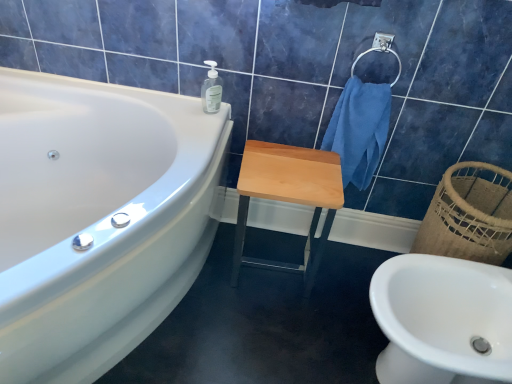
I want to click on free space in front of light wood/matte stool at center, so click(x=269, y=326).